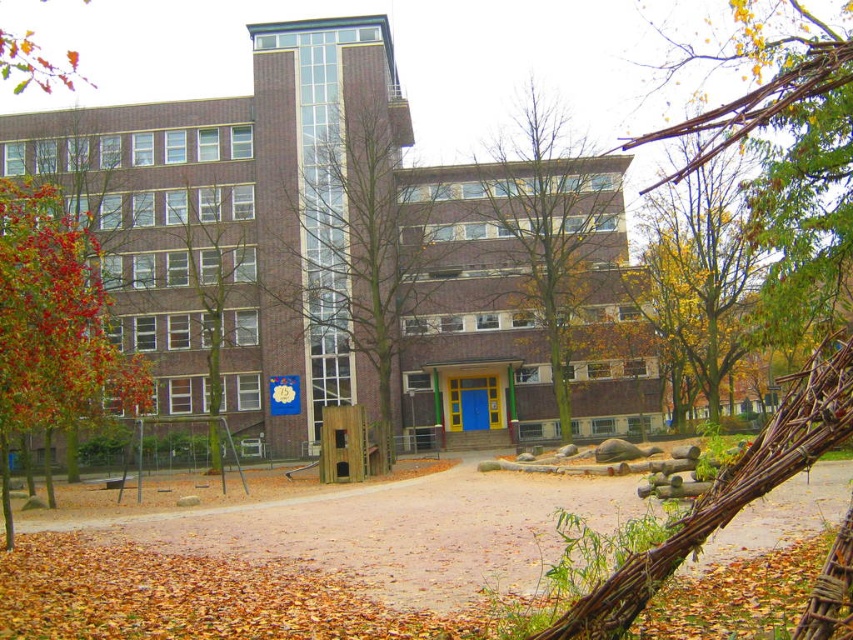
Question: In this image, where is bare wood tree at center located relative to green leafy tree at left?

Choices:
 (A) below
 (B) above

Answer: (B)

Question: Does bare wood tree at center appear over brown leafy tree at center?

Choices:
 (A) yes
 (B) no

Answer: (B)

Question: Does reddish-brown bark tree at left lie in front of green leafy tree at left?

Choices:
 (A) yes
 (B) no

Answer: (A)

Question: Estimate the real-world distances between objects in this image. Which object is closer to the autumn leaves at upper left?

Choices:
 (A) green leafy tree at left
 (B) yellow-green leaves at upper center
 (C) bare wood tree at center
 (D) reddish-brown bark tree at left

Answer: (A)

Question: Among these points, which one is farthest from the camera?

Choices:
 (A) (91, 284)
 (B) (250, 189)

Answer: (B)

Question: Considering the real-world distances, which object is closest to the yellow-green leaves at upper center?

Choices:
 (A) brown leafy tree at center
 (B) reddish-brown bark tree at left
 (C) bare wood tree at center
 (D) green leafy tree at upper right

Answer: (A)